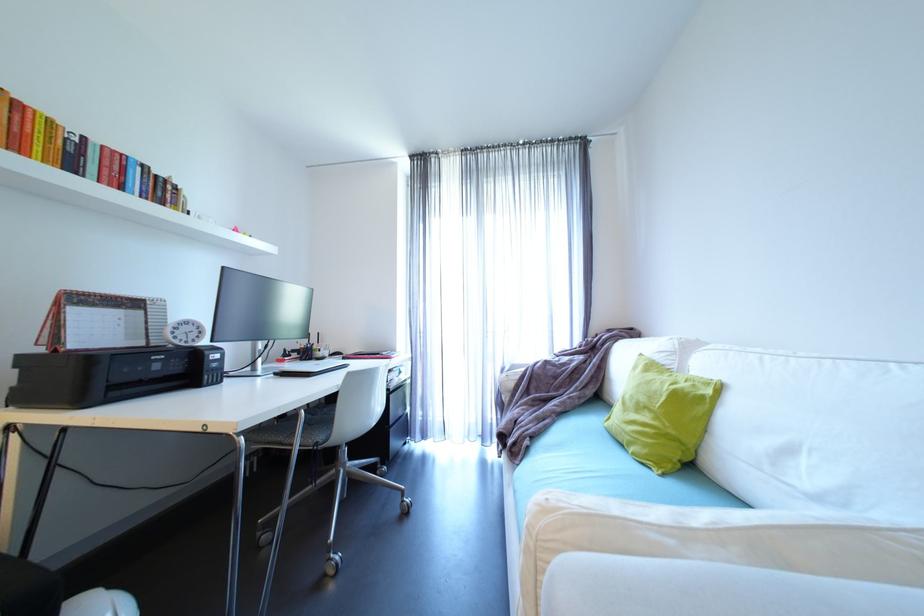
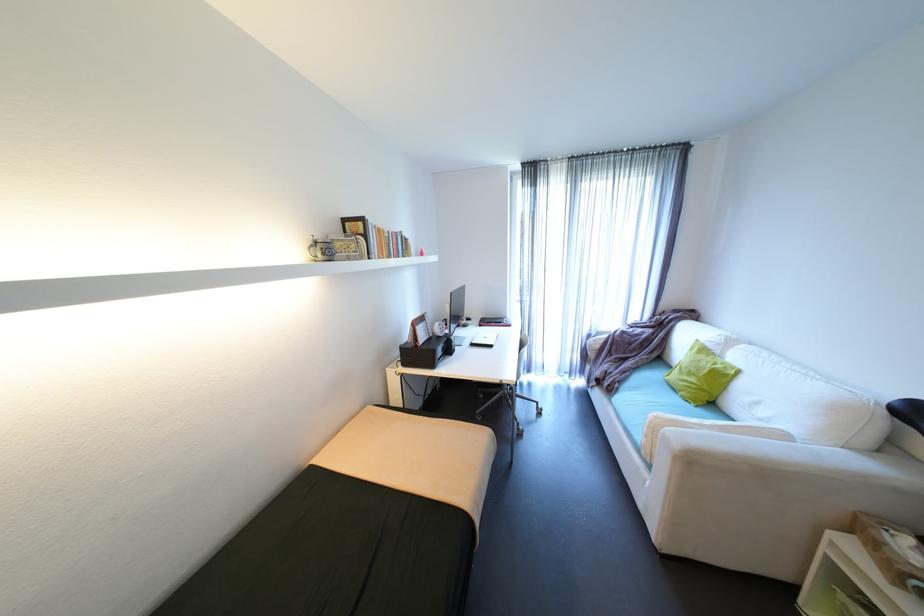
In the second image, find the point that corresponds to (546,426) in the first image.

(630, 377)